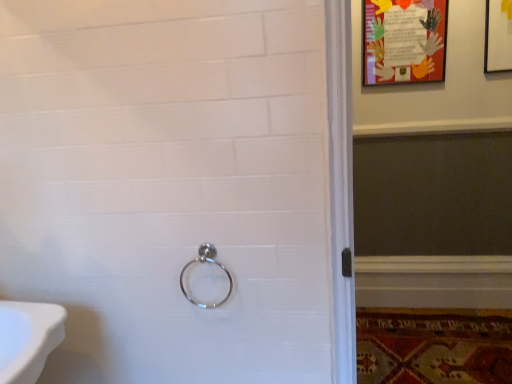
Question: Which is correct: polished metal ring at center is inside colorful paper poster at upper right, or outside of it?

Choices:
 (A) inside
 (B) outside

Answer: (B)

Question: Considering the positions of polished metal ring at center and colorful paper poster at upper right in the image, is polished metal ring at center bigger or smaller than colorful paper poster at upper right?

Choices:
 (A) small
 (B) big

Answer: (A)

Question: Considering the real-world distances, which object is closest to the carpeted mat at lower right?

Choices:
 (A) colorful paper poster at upper right
 (B) polished metal ring at center

Answer: (A)

Question: Based on their relative distances, which object is farther from the polished metal ring at center?

Choices:
 (A) colorful paper poster at upper right
 (B) carpeted mat at lower right

Answer: (A)